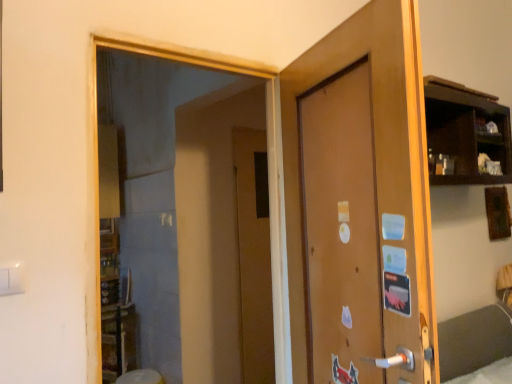
Locate an element on the screen. This screenshot has height=384, width=512. brown matte door at center, which is the 2th door in back-to-front order is located at coordinates (375, 166).

Identify the location of door that is above the transparent glass mirror at upper left (from a real-world perspective). (375, 166).

Are transparent glass mirror at upper left and brown matte door at center, which appears as the first door when viewed from the front, making contact?

There is a gap between transparent glass mirror at upper left and brown matte door at center, which appears as the first door when viewed from the front.

Considering the sizes of objects transparent glass mirror at upper left and brown matte door at center, which appears as the first door when viewed from the front, in the image provided, who is wider, transparent glass mirror at upper left or brown matte door at center, which appears as the first door when viewed from the front,?

Wider between the two is brown matte door at center, which appears as the first door when viewed from the front.

Looking at their sizes, would you say brown matte door at center, which is the 2th door in back-to-front order, is wider or thinner than transparent glass mirror at upper left?

brown matte door at center, which is the 2th door in back-to-front order, is wider than transparent glass mirror at upper left.

From the picture: Considering the sizes of objects brown matte door at center, which is the 2th door in back-to-front order, and transparent glass mirror at upper left in the image provided, who is shorter, brown matte door at center, which is the 2th door in back-to-front order, or transparent glass mirror at upper left?

With less height is brown matte door at center, which is the 2th door in back-to-front order.

Which object is positioned more to the right, brown matte door at center, which is the 2th door in back-to-front order, or transparent glass mirror at upper left?

brown matte door at center, which is the 2th door in back-to-front order, is more to the right.

Considering the positions of objects brown matte door at center, acting as the first door starting from the back, and brown matte door at center, which appears as the first door when viewed from the front, in the image provided, who is more to the right, brown matte door at center, acting as the first door starting from the back, or brown matte door at center, which appears as the first door when viewed from the front,?

From the viewer's perspective, brown matte door at center, which appears as the first door when viewed from the front, appears more on the right side.

From the picture: Considering the relative sizes of brown matte door at center, acting as the first door starting from the back, and brown matte door at center, which appears as the first door when viewed from the front, in the image provided, is brown matte door at center, acting as the first door starting from the back, bigger than brown matte door at center, which appears as the first door when viewed from the front,?

No.

Between point (267, 362) and point (389, 146), which one is positioned in front?

The point (389, 146) is closer.

Looking at this image, which of these two, brown matte door at center, acting as the first door starting from the back, or brown matte door at center, which is the 2th door in back-to-front order, stands taller?

brown matte door at center, acting as the first door starting from the back, is taller.

Would you consider brown matte door at center, acting as the 2th door starting from the front, to be distant from transparent glass mirror at upper left?

That's not correct — brown matte door at center, acting as the 2th door starting from the front, is a little close to transparent glass mirror at upper left.

The image size is (512, 384). I want to click on door below the transparent glass mirror at upper left (from a real-world perspective), so click(254, 256).

From a real-world perspective, is brown matte door at center, acting as the first door starting from the back, located beneath transparent glass mirror at upper left?

Yes, from a real-world perspective, brown matte door at center, acting as the first door starting from the back, is beneath transparent glass mirror at upper left.

Is brown matte door at center, which is the 2th door in back-to-front order, oriented away from brown matte door at center, acting as the first door starting from the back?

No, brown matte door at center, acting as the first door starting from the back, is not at the back of brown matte door at center, which is the 2th door in back-to-front order.

From a real-world perspective, which is physically above, brown matte door at center, which appears as the first door when viewed from the front, or brown matte door at center, acting as the 2th door starting from the front?

In real-world perspective, brown matte door at center, which appears as the first door when viewed from the front, is above.

Considering the sizes of objects brown matte door at center, which appears as the first door when viewed from the front, and brown matte door at center, acting as the 2th door starting from the front, in the image provided, who is bigger, brown matte door at center, which appears as the first door when viewed from the front, or brown matte door at center, acting as the 2th door starting from the front,?

With larger size is brown matte door at center, which appears as the first door when viewed from the front.

Which object is positioned more to the right, brown matte door at center, which appears as the first door when viewed from the front, or brown matte door at center, acting as the first door starting from the back?

From the viewer's perspective, brown matte door at center, which appears as the first door when viewed from the front, appears more on the right side.

Which object is closer to the camera, transparent glass mirror at upper left or brown matte door at center, acting as the 2th door starting from the front?

transparent glass mirror at upper left is closer to the camera.

Is transparent glass mirror at upper left oriented away from brown matte door at center, acting as the first door starting from the back?

No, brown matte door at center, acting as the first door starting from the back, is not at the back of transparent glass mirror at upper left.

Is transparent glass mirror at upper left completely or partially outside of brown matte door at center, acting as the first door starting from the back?

Yes, transparent glass mirror at upper left is located beyond the bounds of brown matte door at center, acting as the first door starting from the back.

How many degrees apart are the facing directions of transparent glass mirror at upper left and brown matte door at center, acting as the 2th door starting from the front?

The facing directions of transparent glass mirror at upper left and brown matte door at center, acting as the 2th door starting from the front, are 0.00038 degrees apart.

Where is `mirror that is on the left side of brown matte door at center, which appears as the first door when viewed from the front`? This screenshot has width=512, height=384. mirror that is on the left side of brown matte door at center, which appears as the first door when viewed from the front is located at coordinates (215, 222).

This screenshot has width=512, height=384. What are the coordinates of `door above the transparent glass mirror at upper left (from a real-world perspective)` in the screenshot? It's located at (375, 166).

When comparing their distances from transparent glass mirror at upper left, does brown matte door at center, acting as the 2th door starting from the front, or brown matte door at center, which appears as the first door when viewed from the front, seem further?

brown matte door at center, which appears as the first door when viewed from the front, is further to transparent glass mirror at upper left.

From the image, which object appears to be farther from brown matte door at center, which appears as the first door when viewed from the front, brown matte door at center, acting as the first door starting from the back, or transparent glass mirror at upper left?

brown matte door at center, acting as the first door starting from the back.

Looking at the image, which one is located closer to brown matte door at center, which appears as the first door when viewed from the front, transparent glass mirror at upper left or brown matte door at center, acting as the 2th door starting from the front?

Among the two, transparent glass mirror at upper left is located nearer to brown matte door at center, which appears as the first door when viewed from the front.

When comparing their distances from transparent glass mirror at upper left, does brown matte door at center, which appears as the first door when viewed from the front, or brown matte door at center, acting as the first door starting from the back, seem closer?

brown matte door at center, acting as the first door starting from the back, is closer to transparent glass mirror at upper left.

Estimate the real-world distances between objects in this image. Which object is further from brown matte door at center, acting as the 2th door starting from the front, brown matte door at center, which appears as the first door when viewed from the front, or transparent glass mirror at upper left?

Among the two, brown matte door at center, which appears as the first door when viewed from the front, is located further to brown matte door at center, acting as the 2th door starting from the front.

Looking at the image, which one is located closer to brown matte door at center, acting as the first door starting from the back, transparent glass mirror at upper left or brown matte door at center, which is the 2th door in back-to-front order?

Based on the image, transparent glass mirror at upper left appears to be nearer to brown matte door at center, acting as the first door starting from the back.

Locate an element on the screen. The image size is (512, 384). mirror between brown matte door at center, which appears as the first door when viewed from the front, and brown matte door at center, acting as the 2th door starting from the front, from front to back is located at coordinates (215, 222).